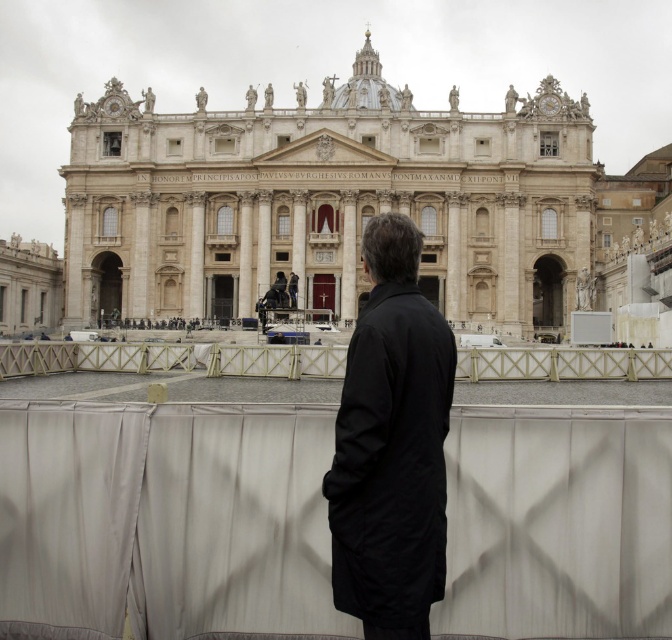
Between black matte coat at center and white wooden rail at center, which one has less height?

white wooden rail at center is shorter.

Which is more to the left, black matte coat at center or white wooden rail at center?

From the viewer's perspective, white wooden rail at center appears more on the left side.

Measure the distance between point [366,396] and camera.

They are 75.62 meters apart.

Image resolution: width=672 pixels, height=640 pixels. Identify the location of black matte coat at center. click(x=390, y=445).

Where is `beige stone palace at center`? beige stone palace at center is located at coordinates (329, 202).

Can you confirm if beige stone palace at center is thinner than white wooden rail at center?

Yes, beige stone palace at center is thinner than white wooden rail at center.

Where is `beige stone palace at center`? The image size is (672, 640). beige stone palace at center is located at coordinates (329, 202).

Is point (552, 232) closer to viewer compared to point (401, 236)?

No, (552, 232) is further to viewer.

Is point (214, 189) closer to camera compared to point (351, 394)?

That is False.

Identify the location of beige stone palace at center. (329, 202).